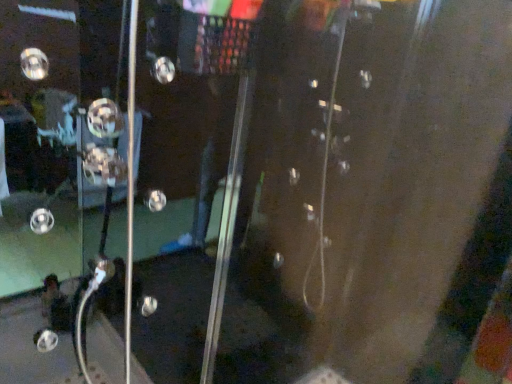
Question: From the image's perspective, relative to transparent glass screen door at left, is metallic knob at center above or below?

Choices:
 (A) below
 (B) above

Answer: (B)

Question: From a real-world perspective, is metallic knob at center positioned above or below transparent glass screen door at left?

Choices:
 (A) below
 (B) above

Answer: (B)

Question: Based on their positions, is metallic knob at center located to the left or right of transparent glass screen door at left?

Choices:
 (A) left
 (B) right

Answer: (A)

Question: Looking at the image, does transparent glass screen door at left seem bigger or smaller compared to metallic knob at center?

Choices:
 (A) big
 (B) small

Answer: (A)

Question: Is transparent glass screen door at left inside or outside of metallic knob at center?

Choices:
 (A) outside
 (B) inside

Answer: (A)

Question: Relative to metallic knob at center, is transparent glass screen door at left in front or behind?

Choices:
 (A) behind
 (B) front

Answer: (B)

Question: Is transparent glass screen door at left to the left or to the right of metallic knob at center in the image?

Choices:
 (A) right
 (B) left

Answer: (A)